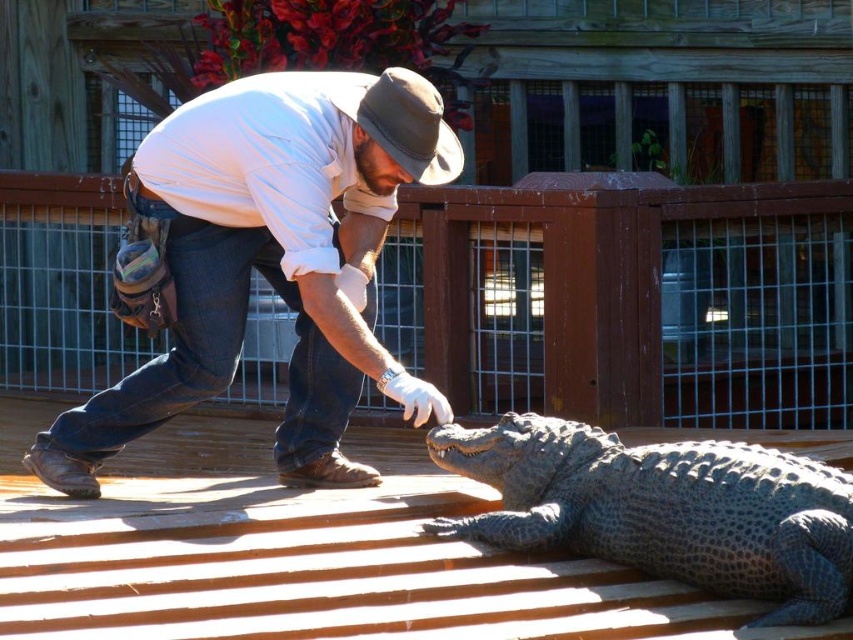
You are a safety inspector checking the scene. The brown wooden deck at center and the gray scaly crocodile at lower right are both present. Which object is located more to the left?

The brown wooden deck at center is positioned on the left side of gray scaly crocodile at lower right, so it is more to the left.

You are a safety inspector assessing the scene. You notice the brown wooden deck at center and the matte white shirt at center. Which object is positioned closer to your viewpoint?

The brown wooden deck at center is closer to the viewer than the matte white shirt at center.

You are a safety officer assessing the scene. The minimum safe distance between a person and a large reptile like an alligator is 6 meters. Are the matte white shirt at center and gray scaly crocodile at lower right within the safe distance?

The matte white shirt at center is 6.41 meters from the gray scaly crocodile at lower right. Since the minimum safe distance is 6 meters, the current distance of 6.41 meters exceeds the required safety threshold. Therefore, the distance between the matte white shirt at center and the gray scaly crocodile at lower right is within the safe range.